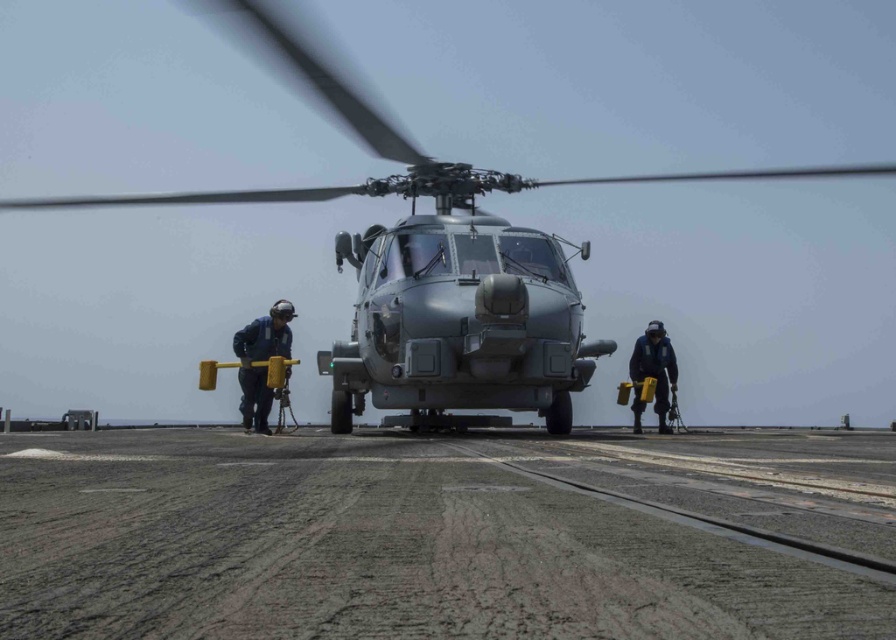
Question: Among these objects, which one is farthest from the camera?

Choices:
 (A) blue uniform at left
 (B) metallic gray helicopter at center
 (C) gray asphalt tarmac at center
 (D) dark blue uniform at right

Answer: (D)

Question: Can you confirm if metallic gray helicopter at center is smaller than blue uniform at left?

Choices:
 (A) yes
 (B) no

Answer: (B)

Question: Can you confirm if metallic gray helicopter at center is positioned below gray asphalt tarmac at center?

Choices:
 (A) no
 (B) yes

Answer: (A)

Question: Which of the following is the farthest from the observer?

Choices:
 (A) blue uniform at left
 (B) dark blue uniform at right
 (C) gray asphalt tarmac at center
 (D) metallic gray helicopter at center

Answer: (B)

Question: From the image, what is the correct spatial relationship of blue uniform at left in relation to dark blue uniform at right?

Choices:
 (A) right
 (B) left

Answer: (B)

Question: Which object is the closest to the dark blue uniform at right?

Choices:
 (A) metallic gray helicopter at center
 (B) blue uniform at left
 (C) gray asphalt tarmac at center

Answer: (A)